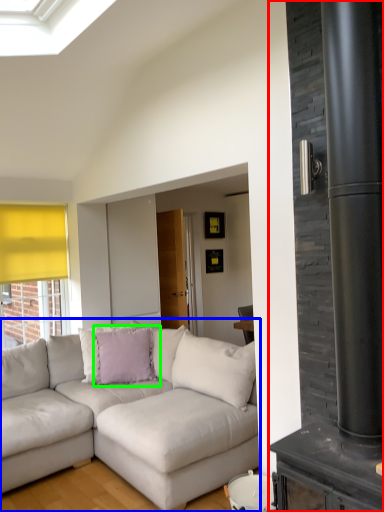
Question: Considering the real-world distances, which object is closest to fireplace (highlighted by a red box)? studio couch (highlighted by a blue box) or pillow (highlighted by a green box).

Choices:
 (A) studio couch
 (B) pillow

Answer: (A)